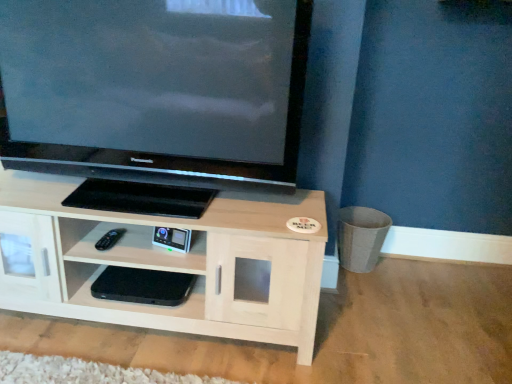
Question: Is light wood shelf at center, the first shelf from the top, turned away from matte black television at upper left?

Choices:
 (A) no
 (B) yes

Answer: (A)

Question: Is the position of light wood shelf at center, acting as the 2th shelf starting from the bottom, less distant than that of matte black television at upper left?

Choices:
 (A) yes
 (B) no

Answer: (B)

Question: Is light wood shelf at center, the first shelf from the top, further to the viewer compared to matte black television at upper left?

Choices:
 (A) yes
 (B) no

Answer: (A)

Question: Can you confirm if light wood shelf at center, acting as the 2th shelf starting from the bottom, is positioned to the left of matte black television at upper left?

Choices:
 (A) yes
 (B) no

Answer: (A)

Question: Is matte black television at upper left located within light wood shelf at center, acting as the 2th shelf starting from the bottom?

Choices:
 (A) yes
 (B) no

Answer: (B)

Question: Is light wood shelf at center, the first shelf from the top, to the right of matte black television at upper left from the viewer's perspective?

Choices:
 (A) no
 (B) yes

Answer: (A)

Question: Can you confirm if black plastic remote at lower left is smaller than light wood shelf at center, the first shelf from the top?

Choices:
 (A) no
 (B) yes

Answer: (B)

Question: Does black plastic remote at lower left touch light wood shelf at center, acting as the 2th shelf starting from the bottom?

Choices:
 (A) yes
 (B) no

Answer: (B)

Question: Considering the relative sizes of black plastic remote at lower left and light wood shelf at center, the first shelf from the top, in the image provided, is black plastic remote at lower left bigger than light wood shelf at center, the first shelf from the top,?

Choices:
 (A) no
 (B) yes

Answer: (A)

Question: Does black plastic remote at lower left lie in front of light wood shelf at center, acting as the 2th shelf starting from the bottom?

Choices:
 (A) yes
 (B) no

Answer: (B)

Question: Considering the relative positions of black plastic remote at lower left and light wood shelf at center, the first shelf from the top, in the image provided, is black plastic remote at lower left to the left of light wood shelf at center, the first shelf from the top, from the viewer's perspective?

Choices:
 (A) yes
 (B) no

Answer: (A)

Question: Is black plastic remote at lower left further to camera compared to light wood shelf at center, acting as the 2th shelf starting from the bottom?

Choices:
 (A) yes
 (B) no

Answer: (A)

Question: From the image's perspective, is black plastic remote at lower left under black matte console at center, which ranks as the first shelf in bottom-to-top order?

Choices:
 (A) yes
 (B) no

Answer: (B)